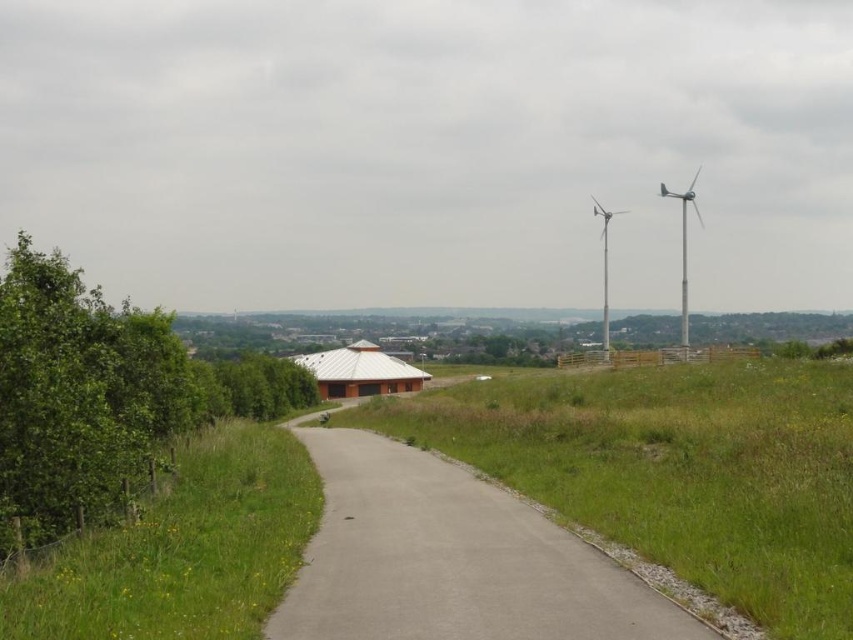
You are standing at the starting point of the curved pathway and want to reach the building with the curved white roof. There are two points marked on the path. The first point is at coordinate point[512,548] and the second point is at coordinate point[606,316]. Which point should you reach first while moving along the path towards the building?

Point[512,548] is in front of point[606,316], so you should reach point[512,548] first before reaching point[606,316] while moving along the path towards the building.

You are a hiker walking along the paved pathway in the rural landscape. You notice the green grass at left and the silver metallic wind turbine at upper right. Which object is closer to you as you walk along the path?

The green grass at left is closer to you because it is in front of the silver metallic wind turbine at upper right, indicating it is nearer in the scene.